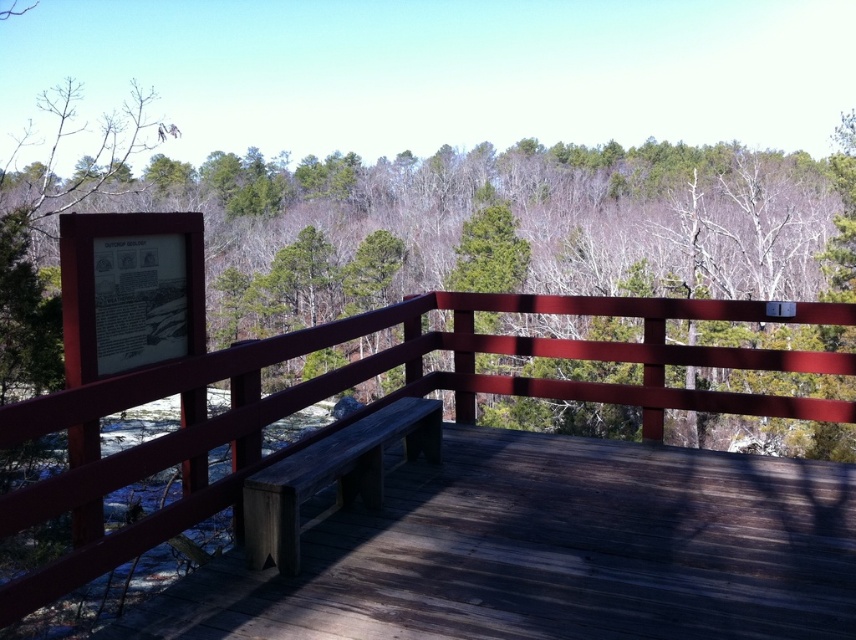
Question: Among these objects, which one is nearest to the camera?

Choices:
 (A) wooden bench at center
 (B) green matte sign at upper left

Answer: (A)

Question: Can you confirm if green matte sign at upper left is positioned to the right of wooden bench at center?

Choices:
 (A) no
 (B) yes

Answer: (B)

Question: Does green matte sign at upper left appear on the left side of wooden bench at center?

Choices:
 (A) yes
 (B) no

Answer: (B)

Question: Is green matte sign at upper left bigger than wooden bench at center?

Choices:
 (A) no
 (B) yes

Answer: (B)